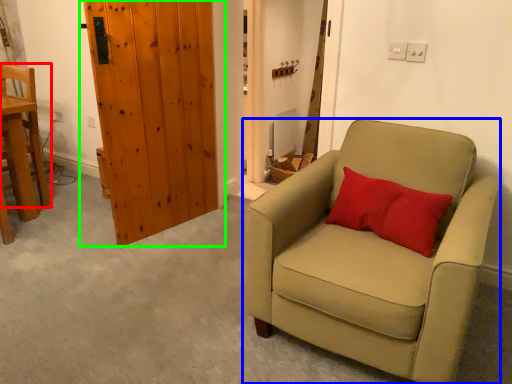
Question: Which object is positioned farthest from chair (highlighted by a red box)? Select from chair (highlighted by a blue box) and door (highlighted by a green box).

Choices:
 (A) chair
 (B) door

Answer: (A)